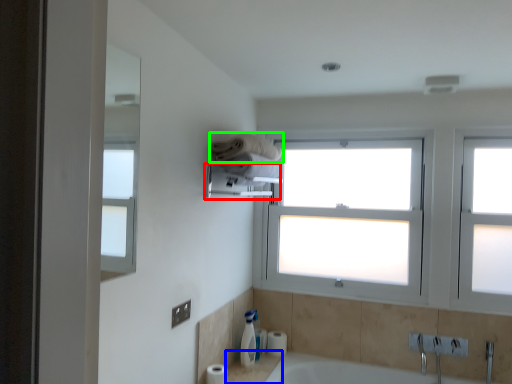
Question: Which object is the farthest from towel bar (highlighted by a red box)? Choose among these: counter top (highlighted by a blue box) or towel (highlighted by a green box).

Choices:
 (A) counter top
 (B) towel

Answer: (A)